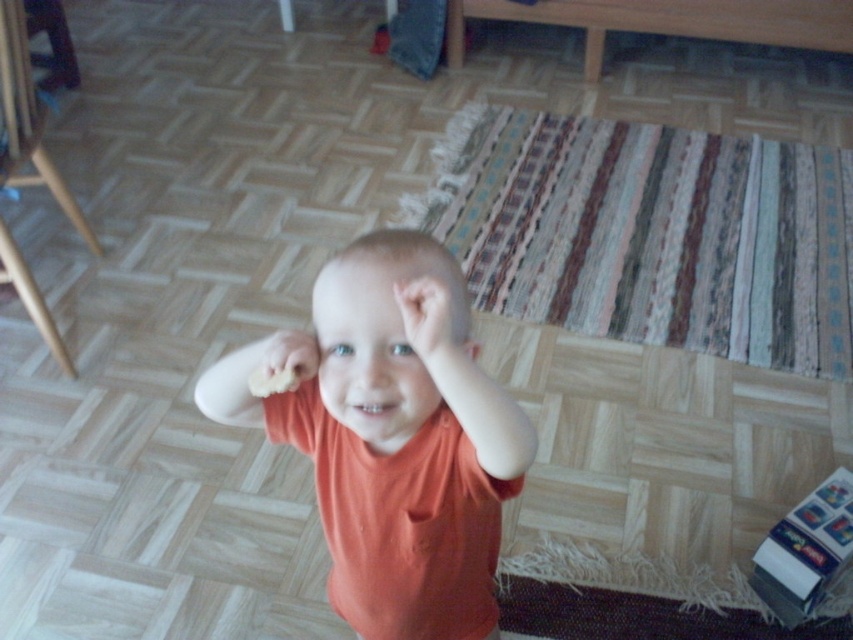
Question: Which of the following is the closest to the observer?

Choices:
 (A) matte orange hand at center
 (B) orange matte head at center
 (C) matte orange ear at center
 (D) orange matte shirt at center

Answer: (B)

Question: Does orange matte shirt at center appear under orange matte head at center?

Choices:
 (A) no
 (B) yes

Answer: (B)

Question: Which of the following is the closest to the observer?

Choices:
 (A) (485, 417)
 (B) (476, 346)

Answer: (A)

Question: Is orange matte head at center to the right of smooth beige hand at center from the viewer's perspective?

Choices:
 (A) no
 (B) yes

Answer: (B)

Question: Does matte orange hand at center appear on the left side of smooth beige hand at center?

Choices:
 (A) no
 (B) yes

Answer: (A)

Question: Which point is closer to the camera?

Choices:
 (A) (426, 412)
 (B) (426, 301)
 (C) (469, 355)

Answer: (B)